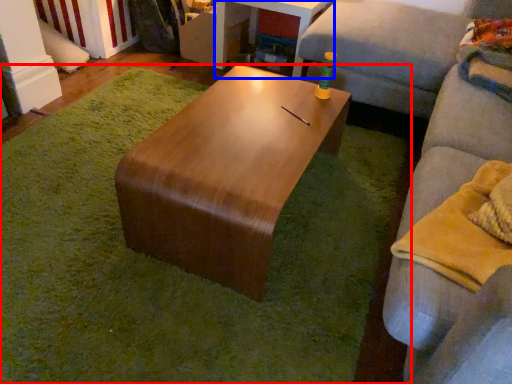
Question: Which point is further to the camera, mat (highlighted by a red box) or table (highlighted by a blue box)?

Choices:
 (A) mat
 (B) table

Answer: (B)